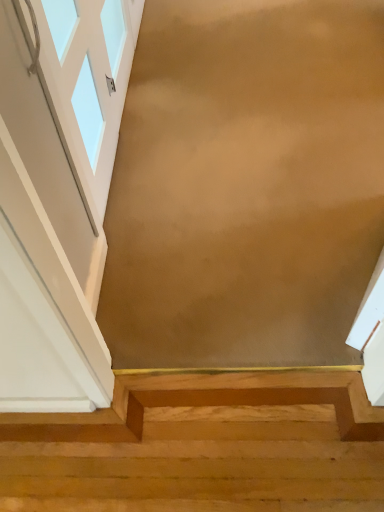
At what (x,y) coordinates should I click in order to perform the action: click on white glass window at upper left. Please return your answer as a coordinate pair (x, y). Image resolution: width=384 pixels, height=512 pixels. Looking at the image, I should click on (88, 64).

What do you see at coordinates (88, 64) in the screenshot? Image resolution: width=384 pixels, height=512 pixels. I see `white glass window at upper left` at bounding box center [88, 64].

What do you see at coordinates (203, 447) in the screenshot? I see `light wood stairs at lower center` at bounding box center [203, 447].

Locate an element on the screen. Image resolution: width=384 pixels, height=512 pixels. light wood stairs at lower center is located at coordinates (203, 447).

Where is `white glass window at upper left`? Image resolution: width=384 pixels, height=512 pixels. white glass window at upper left is located at coordinates (88, 64).

Visually, is light wood stairs at lower center positioned to the left or to the right of white glass window at upper left?

light wood stairs at lower center is positioned on white glass window at upper left's right side.

Considering the positions of objects light wood stairs at lower center and white glass window at upper left in the image provided, who is behind, light wood stairs at lower center or white glass window at upper left?

light wood stairs at lower center is behind.

Which is in front, point (58, 417) or point (119, 14)?

Point (58, 417)

From the image's perspective, would you say light wood stairs at lower center is shown under white glass window at upper left?

Correct, light wood stairs at lower center appears lower than white glass window at upper left in the image.

From a real-world perspective, is light wood stairs at lower center physically located above or below white glass window at upper left?

In terms of real-world spatial position, light wood stairs at lower center is below white glass window at upper left.

Between light wood stairs at lower center and white glass window at upper left, which one has smaller width?

Thinner between the two is white glass window at upper left.

Which of these two, light wood stairs at lower center or white glass window at upper left, stands shorter?

With less height is light wood stairs at lower center.

Considering the sizes of objects light wood stairs at lower center and white glass window at upper left in the image provided, who is bigger, light wood stairs at lower center or white glass window at upper left?

Bigger between the two is light wood stairs at lower center.

Could white glass window at upper left be considered to be inside light wood stairs at lower center?

Actually, white glass window at upper left is outside light wood stairs at lower center.

Is light wood stairs at lower center not close to white glass window at upper left?

Yes.

Is light wood stairs at lower center oriented towards white glass window at upper left?

No, light wood stairs at lower center is not facing towards white glass window at upper left.

What are the coordinates of `window in front of the light wood stairs at lower center` in the screenshot? It's located at (88, 64).

Can you confirm if white glass window at upper left is positioned to the right of light wood stairs at lower center?

In fact, white glass window at upper left is to the left of light wood stairs at lower center.

Who is more distant, white glass window at upper left or light wood stairs at lower center?

light wood stairs at lower center is further from the camera.

Is point (94, 120) closer or farther from the camera than point (252, 449)?

Point (94, 120).

From the image's perspective, is white glass window at upper left below light wood stairs at lower center?

No, from the image's perspective, white glass window at upper left is not below light wood stairs at lower center.

From a real-world perspective, is white glass window at upper left on top of light wood stairs at lower center?

Yes, from a real-world perspective, white glass window at upper left is on top of light wood stairs at lower center.

Considering the sizes of white glass window at upper left and light wood stairs at lower center in the image, is white glass window at upper left wider or thinner than light wood stairs at lower center?

Clearly, white glass window at upper left has less width compared to light wood stairs at lower center.

Considering the sizes of white glass window at upper left and light wood stairs at lower center in the image, is white glass window at upper left taller or shorter than light wood stairs at lower center?

white glass window at upper left is taller than light wood stairs at lower center.

Based on their sizes in the image, would you say white glass window at upper left is bigger or smaller than light wood stairs at lower center?

Considering their sizes, white glass window at upper left takes up less space than light wood stairs at lower center.

Is white glass window at upper left positioned beyond the bounds of light wood stairs at lower center?

That's correct, white glass window at upper left is outside of light wood stairs at lower center.

Are white glass window at upper left and light wood stairs at lower center far apart?

Yes, white glass window at upper left and light wood stairs at lower center are located far from each other.

Is white glass window at upper left facing towards light wood stairs at lower center?

No, white glass window at upper left is not aimed at light wood stairs at lower center.

Measure the distance between white glass window at upper left and light wood stairs at lower center.

A distance of 3.98 feet exists between white glass window at upper left and light wood stairs at lower center.

Image resolution: width=384 pixels, height=512 pixels. What are the coordinates of `stairs below the white glass window at upper left (from a real-world perspective)` in the screenshot? It's located at (203, 447).

You are a GUI agent. You are given a task and a screenshot of the screen. Output one action in this format:
    pyautogui.click(x=<x>, y=<y>)
    Task: Click on the stairs lying behind the white glass window at upper left
    This screenshot has width=384, height=512.
    Given the screenshot: What is the action you would take?
    pyautogui.click(x=203, y=447)

In the image, there is a white glass window at upper left. At what (x,y) coordinates should I click in order to perform the action: click on stairs below it (from a real-world perspective). Please return your answer as a coordinate pair (x, y). Looking at the image, I should click on (203, 447).